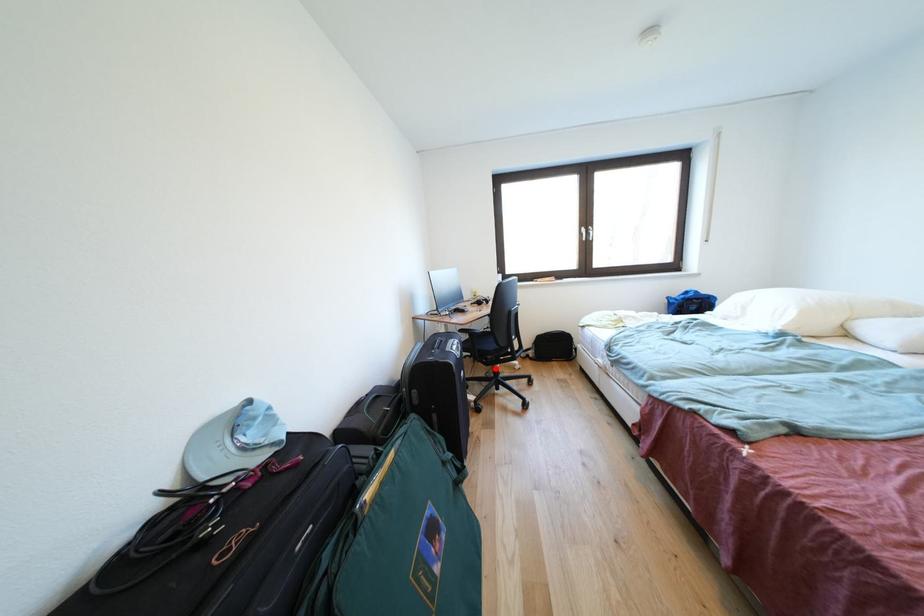
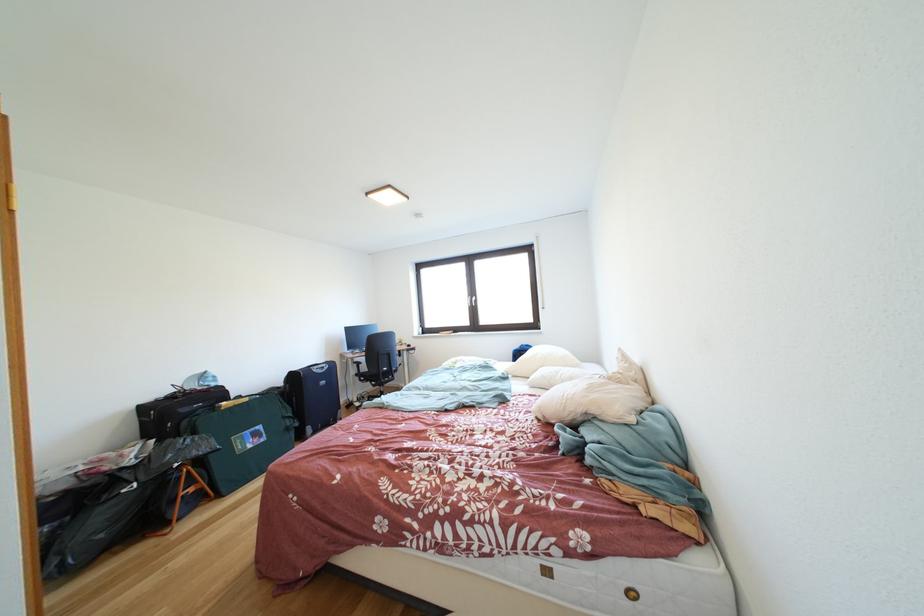
Question: I am providing you with two images of the same scene from different viewpoints. Image1 has a red point marked. In image2, the corresponding 3D location appears at what relative position? Reply with the corresponding letter.

Choices:
 (A) Closer
 (B) Farther

Answer: (B)